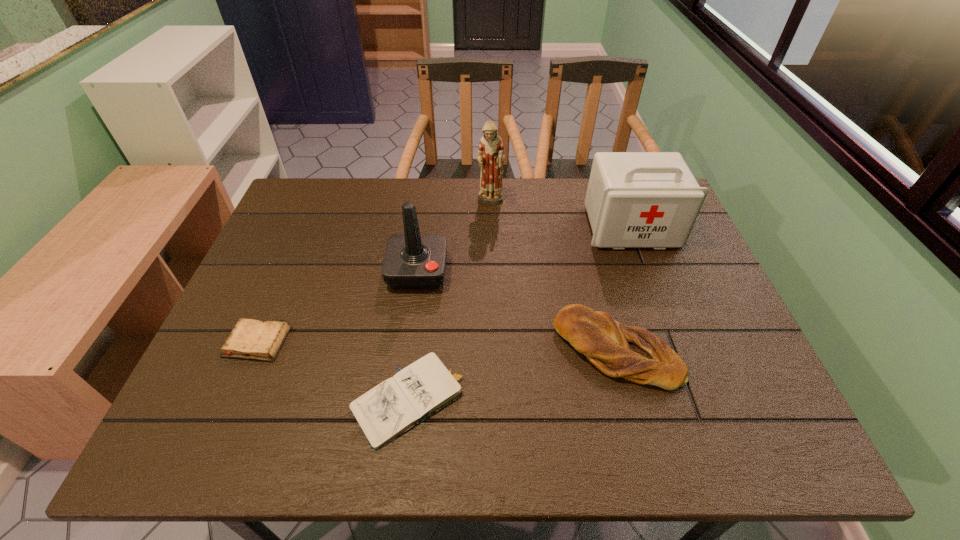
This screenshot has height=540, width=960. In order to click on vacant region located 0.320m on the back of the leftmost object in this screenshot , I will do `click(302, 235)`.

Locate an element on the screen. The width and height of the screenshot is (960, 540). free location located 0.340m on the right of the notebook is located at coordinates (637, 401).

At what (x,y) coordinates should I click in order to perform the action: click on figurine at the far edge. Please return your answer as a coordinate pair (x, y). The image size is (960, 540). Looking at the image, I should click on (491, 153).

Image resolution: width=960 pixels, height=540 pixels. Find the location of `the first-aid kit at the far edge`. the first-aid kit at the far edge is located at coordinates (634, 199).

You are a GUI agent. You are given a task and a screenshot of the screen. Output one action in this format:
    pyautogui.click(x=<x>, y=<y>)
    Task: Click on the object positioned at the near edge
    This screenshot has width=960, height=540.
    Given the screenshot: What is the action you would take?
    pyautogui.click(x=397, y=404)

Locate an element on the screen. object situated at the left edge is located at coordinates (252, 339).

The height and width of the screenshot is (540, 960). In order to click on the first-aid kit situated at the right edge in this screenshot , I will do coord(634,199).

The width and height of the screenshot is (960, 540). What are the coordinates of `bread that is positioned at the right edge` in the screenshot? It's located at (633, 353).

Identify the location of object that is positioned at the far right corner. This screenshot has height=540, width=960. (634, 199).

In the image, there is a desktop. Where is `vacant area at the far edge`? The image size is (960, 540). vacant area at the far edge is located at coordinates (513, 185).